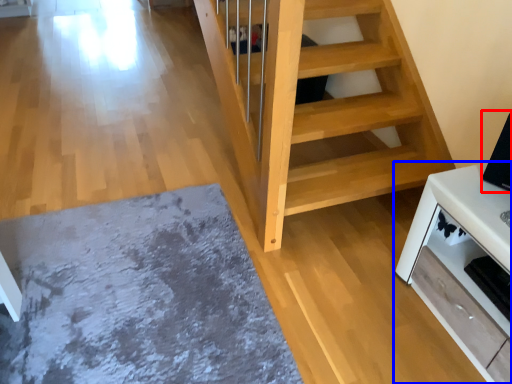
Question: Which point is closer to the camera, appliance (highlighted by a red box) or furniture (highlighted by a blue box)?

Choices:
 (A) appliance
 (B) furniture

Answer: (B)